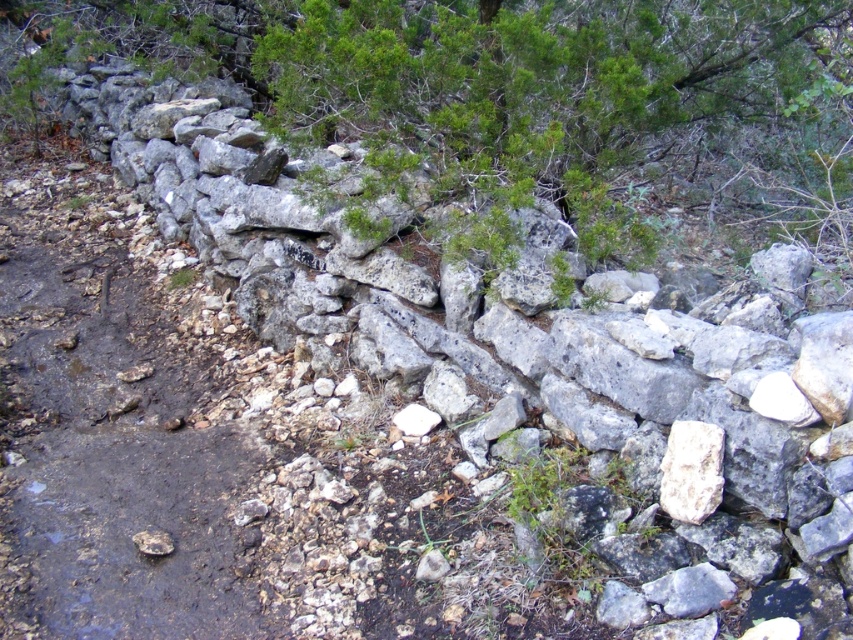
You are a hiker who wants to cross the stone wall safely. You see the dull gray dirt track at center and the white rough rock at center. Which path should you choose to avoid the slippery surface?

The white rough rock at center is located below the dull gray dirt track at center. Since the white rough rock at center has a rough texture, it provides better traction and is less slippery compared to the dull gray dirt track at center. Therefore, you should choose the white rough rock at center to cross safely.

You are standing in front of the stone wall and want to determine the relative positions of two points marked on the wall. The first point is at coordinates point (160, 317) and the second is at point (712, 440). Which point is closer to you?

Point (160, 317) is closer to you because it is further to the viewer than point (712, 440).

You are a hiker trying to cross the terrain near the stone wall. You notice the dull gray dirt track at center and the white rough rock at center. Which one is higher in elevation?

The dull gray dirt track at center is taller than the white rough rock at center, so the dirt track is higher in elevation.